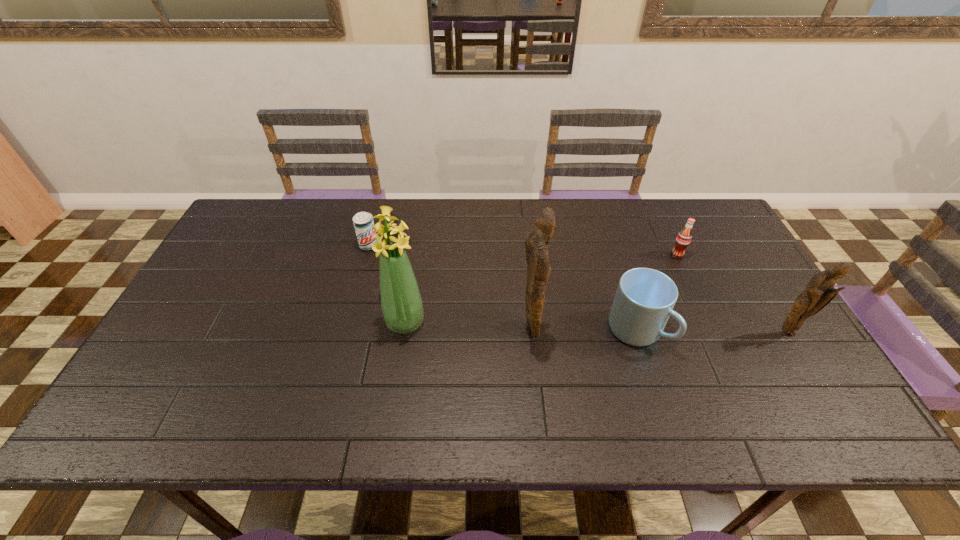
You are a GUI agent. You are given a task and a screenshot of the screen. Output one action in this format:
    pyautogui.click(x=<x>, y=<y>)
    Task: Click on the free space for a new figurine on the left
    The height and width of the screenshot is (540, 960).
    Given the screenshot: What is the action you would take?
    pyautogui.click(x=272, y=331)